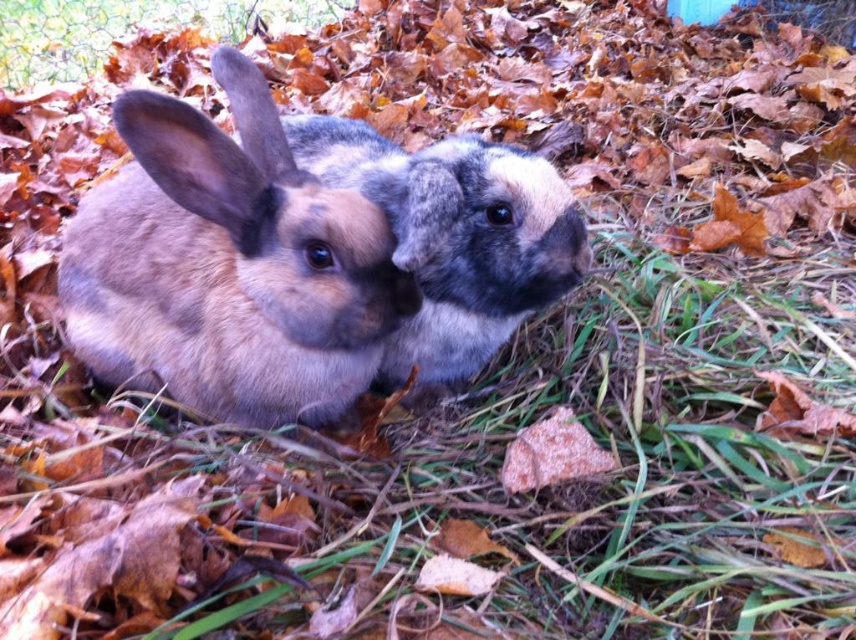
You are a small insect trying to hide from the wind. You notice the fuzzy brown rabbit at left and the green grass at upper left. Which location would provide better shelter based on their sizes?

The fuzzy brown rabbit at left has a greater height compared to the green grass at upper left, so it would provide better shelter from the wind.

You are a photographer trying to capture the fuzzy brown rabbit at left and the fuzzy brown rabbit at center in a clear photo. Which rabbit might be partially hidden by the other?

The fuzzy brown rabbit at center might be partially hidden because the fuzzy brown rabbit at left is positioned over it.